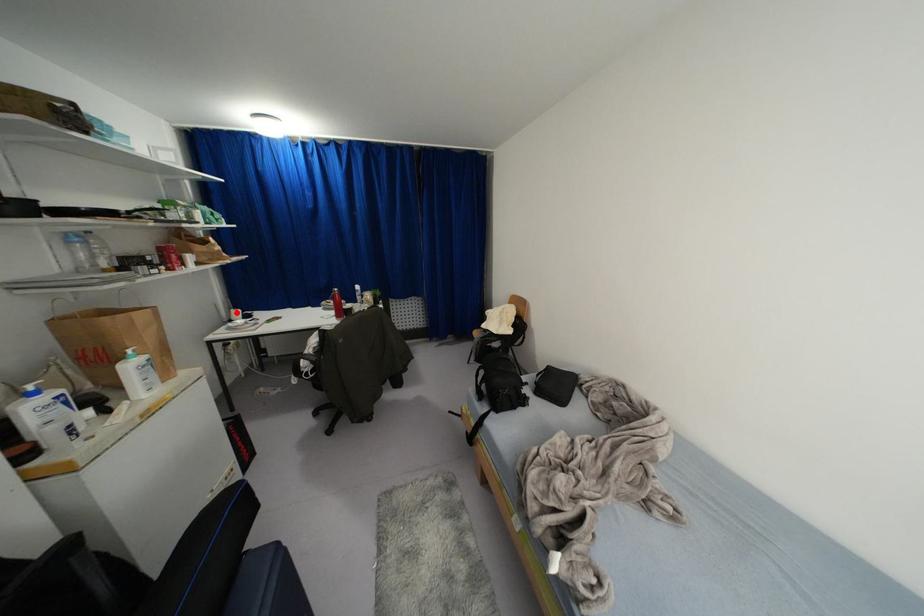
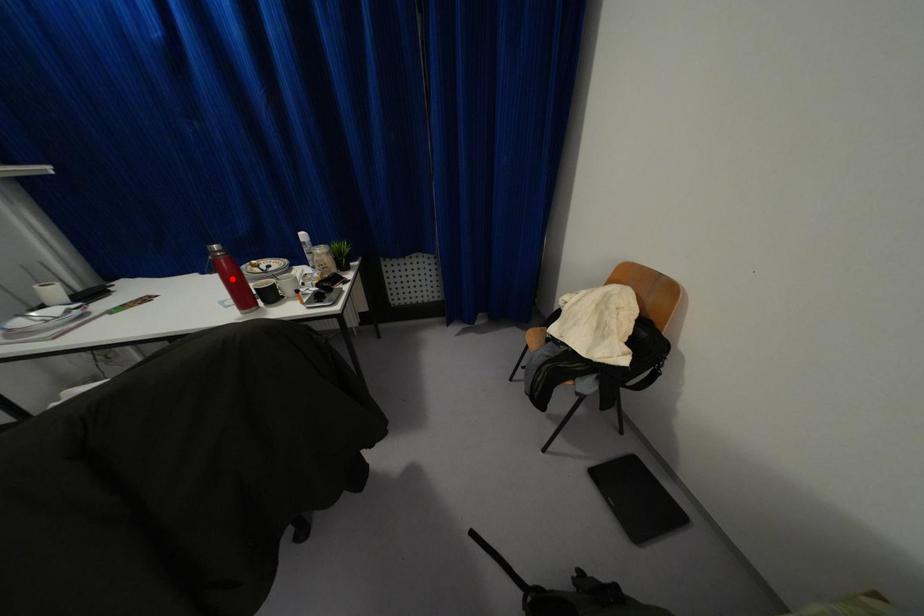
I am providing you with two images of the same scene from different viewpoints. A red point is marked on the first image and another point is marked on the second image. Is the red point in image1 aligned with the point shown in image2?

No